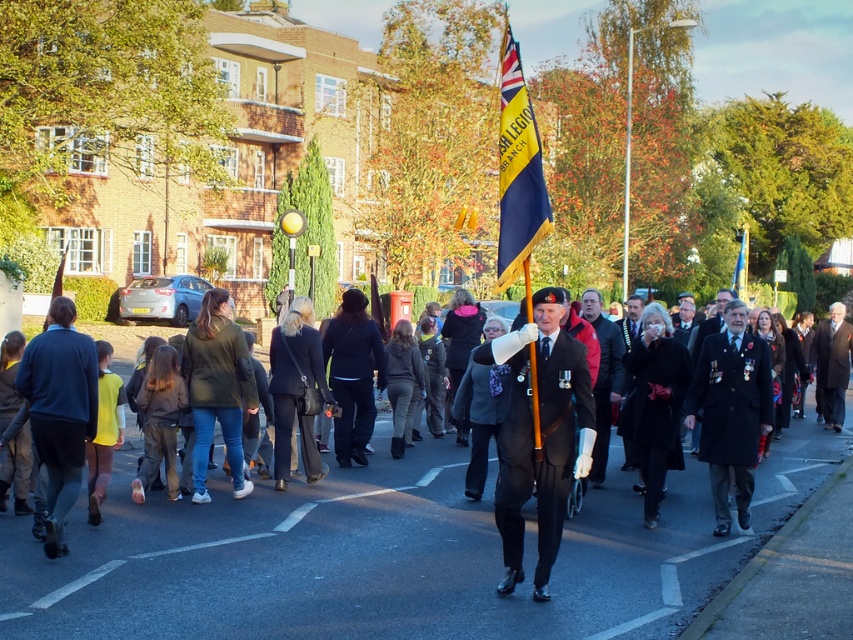
Question: Does yellow fabric flag at center appear over blue fabric flag at center?

Choices:
 (A) no
 (B) yes

Answer: (A)

Question: Is yellow fabric flag at center to the left of black velvet coat at center from the viewer's perspective?

Choices:
 (A) yes
 (B) no

Answer: (A)

Question: Which point appears closest to the camera in this image?

Choices:
 (A) (521, 260)
 (B) (746, 250)
 (C) (819, 364)

Answer: (A)

Question: Which object is closer to the camera taking this photo?

Choices:
 (A) dark brown leather coat at center
 (B) dark gray wool coat at center
 (C) black velvet coat at center
 (D) yellow fabric flag at center

Answer: (D)

Question: Which is nearer to the black velvet coat at center?

Choices:
 (A) blue fabric flag at center
 (B) dark brown leather coat at center
 (C) dark gray wool coat at center

Answer: (C)

Question: Does dark blue sweater at left have a larger size compared to black velvet coat at center?

Choices:
 (A) no
 (B) yes

Answer: (B)